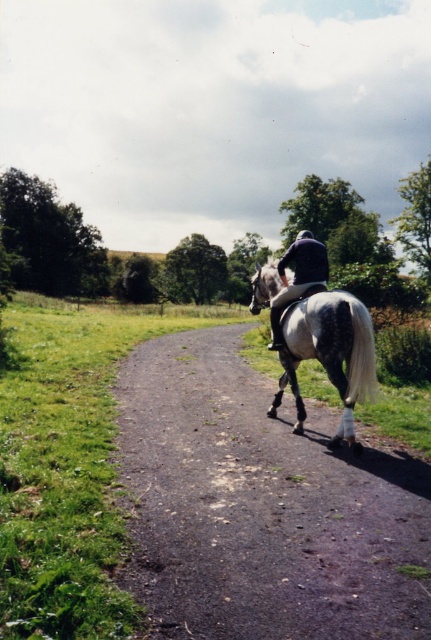
You are standing at the point labeled as point (212,620) in this rural scene. A rider on a horse is approaching you along the dirt path. If the rider maintains their current speed of 3 miles per hour, how many seconds will it take for them to reach your position?

The rider is currently 10.60 feet away from point (212,620). At a speed of 3 miles per hour, the rider will take approximately 6.3 seconds to reach your position. This is calculated by converting 3 mph to feet per second and dividing the distance by the speed.